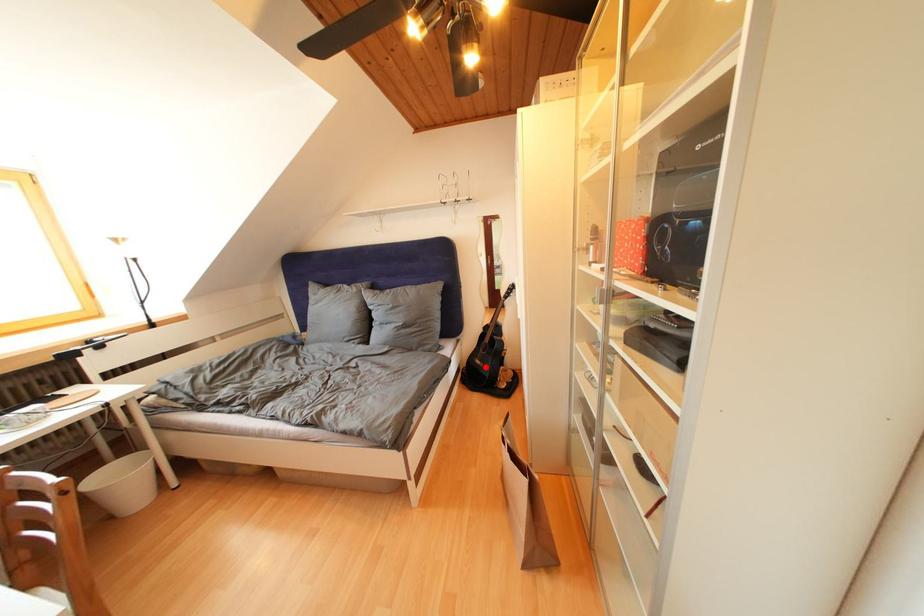
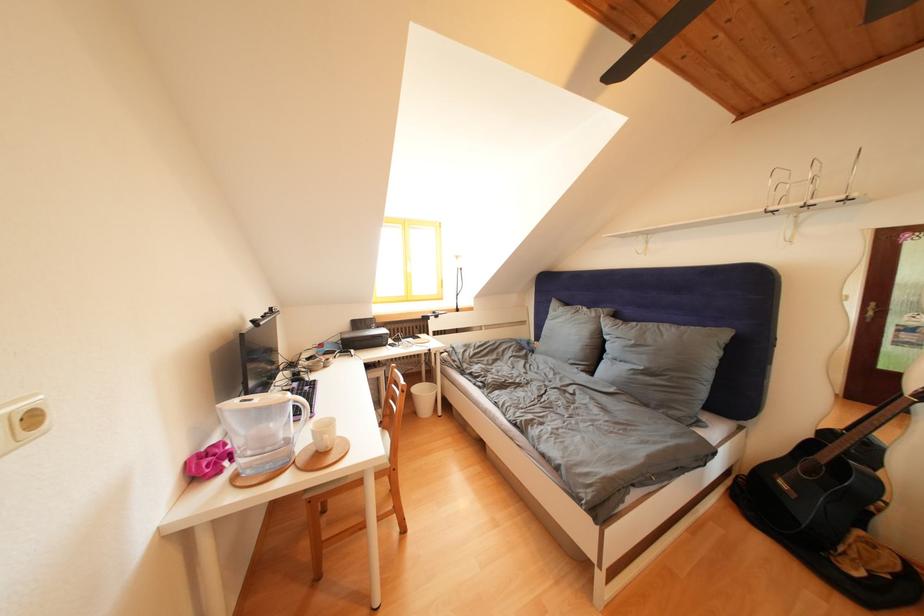
Question: I am providing you with two images of the same scene from different viewpoints. Image1 has a red point marked. In image2, the corresponding 3D location appears at what relative position? Reply with the corresponding letter.

Choices:
 (A) Closer
 (B) Farther

Answer: (A)